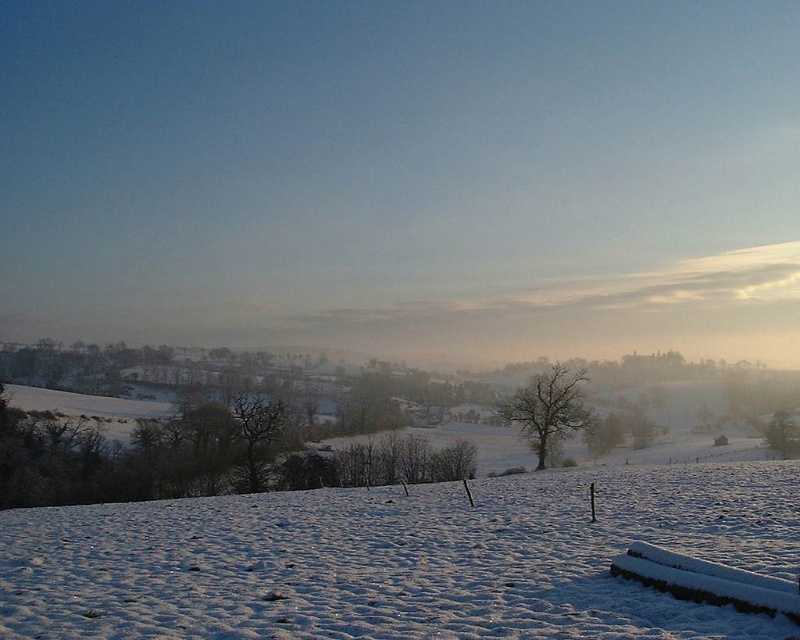
Is white fluffy snow at center behind dark brown textured tree at center?

No, white fluffy snow at center is closer to the viewer.

Does white fluffy snow at center have a greater width compared to dark brown textured tree at center?

Yes, white fluffy snow at center is wider than dark brown textured tree at center.

Describe the element at coordinates (400, 560) in the screenshot. I see `white fluffy snow at center` at that location.

Locate an element on the screen. white fluffy snow at center is located at coordinates pos(400,560).

Does bare tree at center have a lesser width compared to dark brown textured tree at center?

In fact, bare tree at center might be wider than dark brown textured tree at center.

Image resolution: width=800 pixels, height=640 pixels. In order to click on bare tree at center in this screenshot , I will do `click(548, 408)`.

What do you see at coordinates (548, 408) in the screenshot? The height and width of the screenshot is (640, 800). I see `bare tree at center` at bounding box center [548, 408].

Identify the location of bare tree at center. Image resolution: width=800 pixels, height=640 pixels. (548, 408).

Describe the element at coordinates (400, 560) in the screenshot. I see `white fluffy snow at center` at that location.

Can you confirm if white fluffy snow at center is shorter than bare tree at center?

Indeed, white fluffy snow at center has a lesser height compared to bare tree at center.

Image resolution: width=800 pixels, height=640 pixels. In order to click on white fluffy snow at center in this screenshot , I will do `click(400, 560)`.